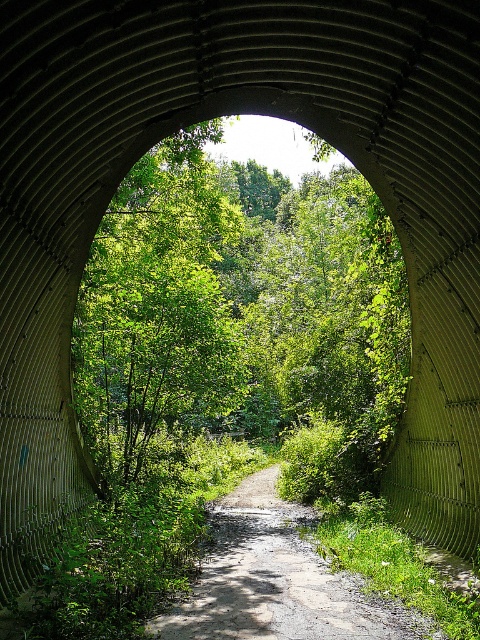
Question: Is green leafy tree at center closer to the viewer compared to dirt/gravel path at center?

Choices:
 (A) yes
 (B) no

Answer: (B)

Question: Is green leafy tree at center thinner than dirt/gravel path at center?

Choices:
 (A) no
 (B) yes

Answer: (A)

Question: Which of the following is the farthest from the observer?

Choices:
 (A) green leafy tree at center
 (B) dirt/gravel path at center

Answer: (A)

Question: From the image, what is the correct spatial relationship of green leafy tree at center in relation to dirt/gravel path at center?

Choices:
 (A) above
 (B) below

Answer: (A)